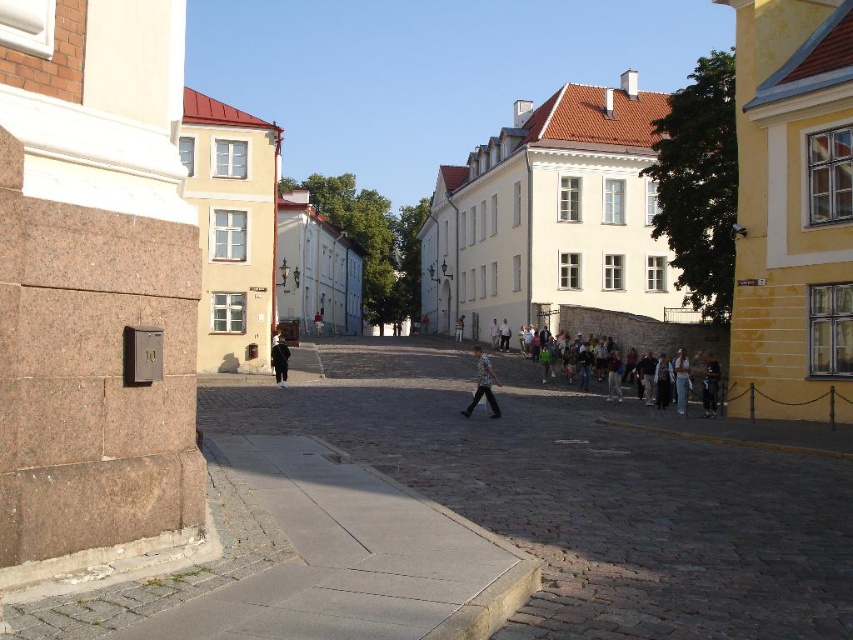
Who is positioned more to the right, striped shirt at center or black matte jacket at center?

From the viewer's perspective, striped shirt at center appears more on the right side.

Which is in front, point (485, 378) or point (270, 358)?

Point (485, 378)

Identify the location of striped shirt at center. (483, 385).